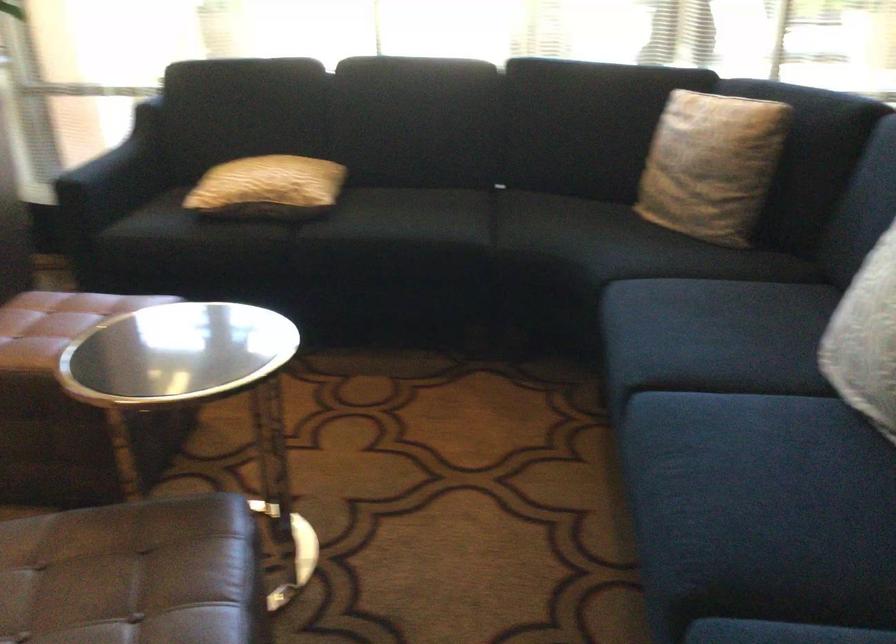
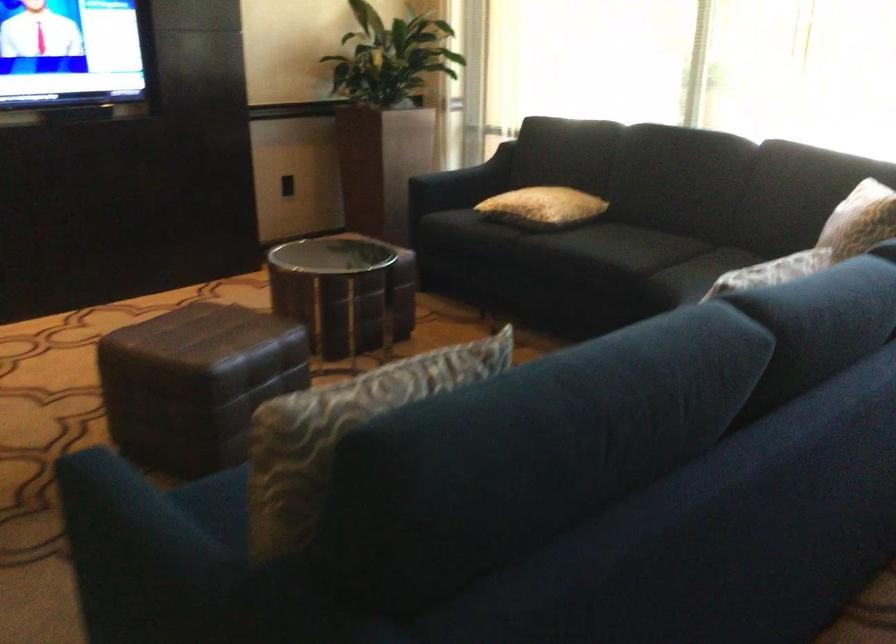
Where in the second image is the point corresponding to (x=755, y=138) from the first image?

(859, 220)